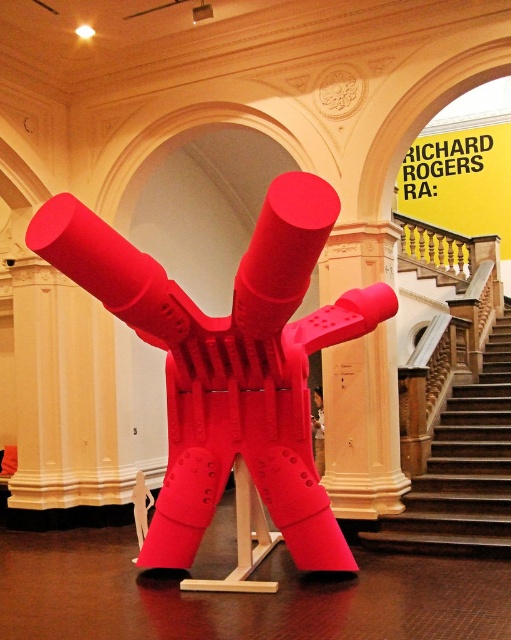
You are an art curator planning to move the wooden staircase at center to a different location. However, you must ensure that the matte plastic sculpture at center remains visible from the entrance. Can the sculpture still be seen if the staircase is moved to the left side of the room?

The matte plastic sculpture at center is currently above the wooden staircase at center. If the staircase is moved to the left side, the sculpture would no longer be obstructed by the staircase, so it should still be visible from the entrance.

In the scene shown: You are an art curator standing at the entrance of the gallery. You want to place a new sculpture that is 2 meters wide in front of the matte white column at center. Considering the space between you and the column, will there be enough room for the sculpture to be placed without it overlapping with the column?

The matte white column at center is 6.90 meters away from the camera. Since the sculpture is 2 meters wide, there should be sufficient space to place it in front of the column without overlapping, as the distance is greater than the sculpture width.

You are a visitor in the museum and want to take a photo of the matte white column at center without the wooden staircase at center appearing in the background. Can you step back enough to do this?

The matte white column at center is only 36.00 inches away from the wooden staircase at center. Stepping back might not be sufficient to exclude the staircase from the photo, as the distance between them is relatively short.